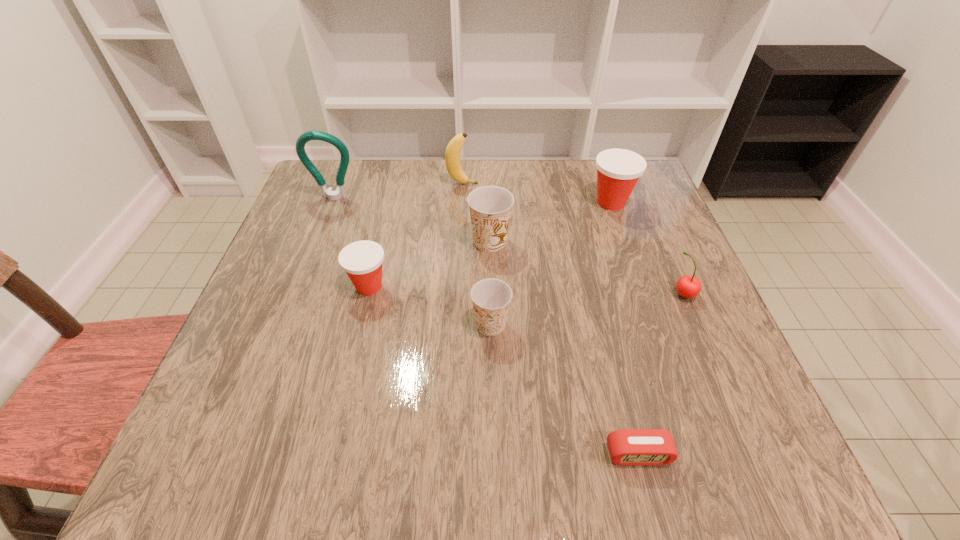
You are a GUI agent. You are given a task and a screenshot of the screen. Output one action in this format:
    pyautogui.click(x=<x>, y=<y>)
    Task: Click on the object that is at the far left corner
    This screenshot has width=960, height=540.
    Given the screenshot: What is the action you would take?
    pyautogui.click(x=340, y=192)

You are a GUI agent. You are given a task and a screenshot of the screen. Output one action in this format:
    pyautogui.click(x=<x>, y=<y>)
    Task: Click on the object that is at the far right corner
    
    Given the screenshot: What is the action you would take?
    pyautogui.click(x=618, y=170)

The height and width of the screenshot is (540, 960). Identify the location of vacant space at the far edge of the desktop. (367, 206).

The height and width of the screenshot is (540, 960). Find the location of `vacant space at the left edge`. vacant space at the left edge is located at coordinates (292, 298).

Image resolution: width=960 pixels, height=540 pixels. I want to click on free location at the right edge, so click(720, 353).

The height and width of the screenshot is (540, 960). In the image, there is a desktop. What are the coordinates of `vacant space at the near left corner` in the screenshot? It's located at (201, 468).

The width and height of the screenshot is (960, 540). In order to click on free spot between the second nearest Dixie cup and the tallest object in this screenshot , I will do `click(351, 242)`.

Identify the location of free spot between the leftmost object and the nearest Dixie cup. The height and width of the screenshot is (540, 960). [x=413, y=261].

Locate an element on the screen. The image size is (960, 540). free space between the right red-orange Dixie cup and the alarm clock is located at coordinates (624, 328).

I want to click on vacant space in between the shortest object and the rightmost Dixie cup, so click(x=624, y=328).